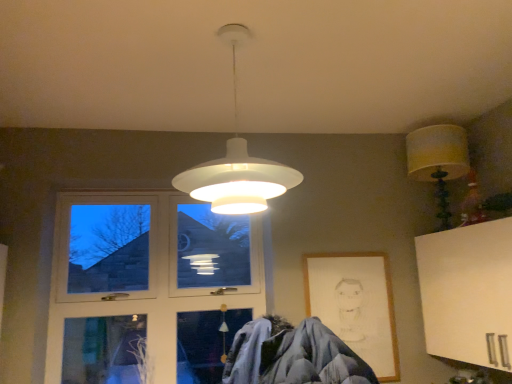
Question: Looking at their shapes, would you say clear glass window at left is wider or thinner than wooden picture frame at lower right?

Choices:
 (A) thin
 (B) wide

Answer: (B)

Question: Would you say clear glass window at left is inside or outside wooden picture frame at lower right?

Choices:
 (A) outside
 (B) inside

Answer: (A)

Question: Which object is the farthest from the white matte pendant light at center, positioned as the first lamp in left-to-right order?

Choices:
 (A) wooden picture frame at lower right
 (B) clear glass window at left
 (C) yellow fabric lampshade at upper right, the 1th lamp positioned from the back

Answer: (C)

Question: Estimate the real-world distances between objects in this image. Which object is farther from the white matte pendant light at center, placed as the second lamp when sorted from right to left?

Choices:
 (A) clear glass window at left
 (B) wooden picture frame at lower right
 (C) yellow fabric lampshade at upper right, which is the 1th lamp in right-to-left order

Answer: (C)